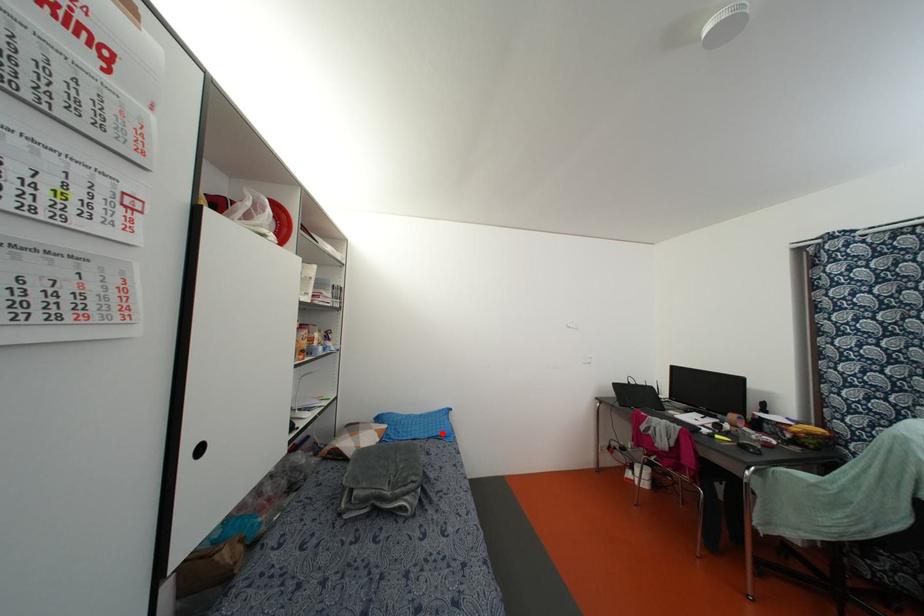
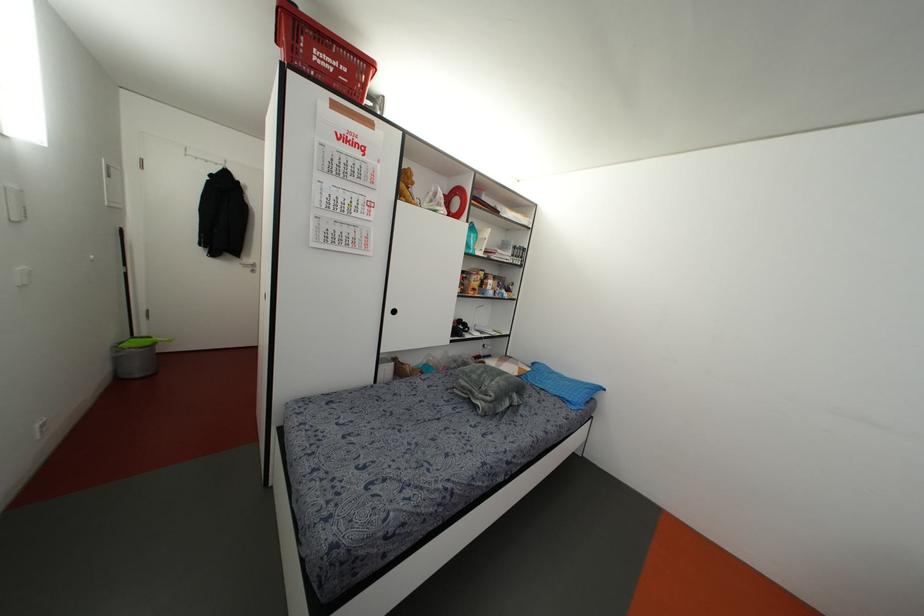
The point at the highlighted location is marked in the first image. Where is the corresponding point in the second image?

(569, 399)